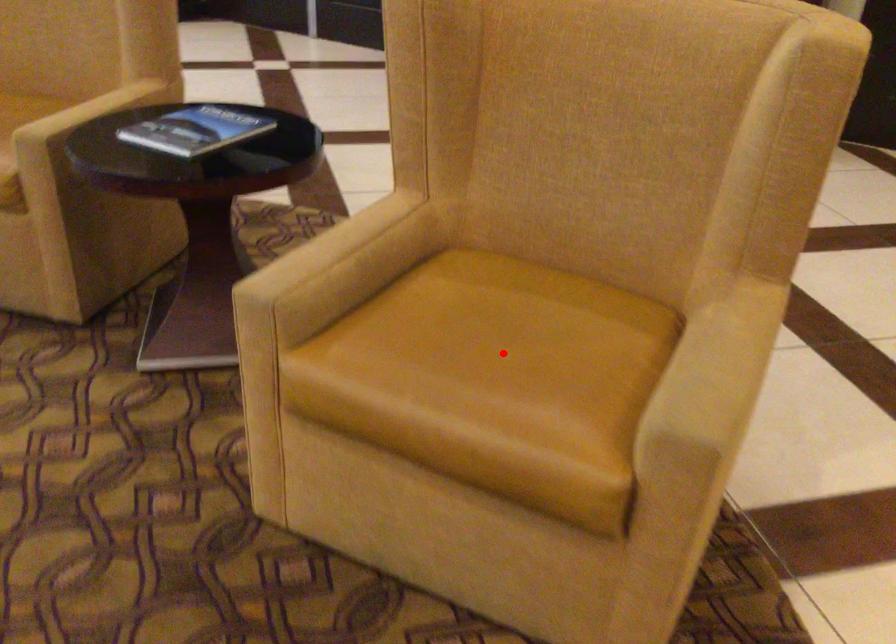
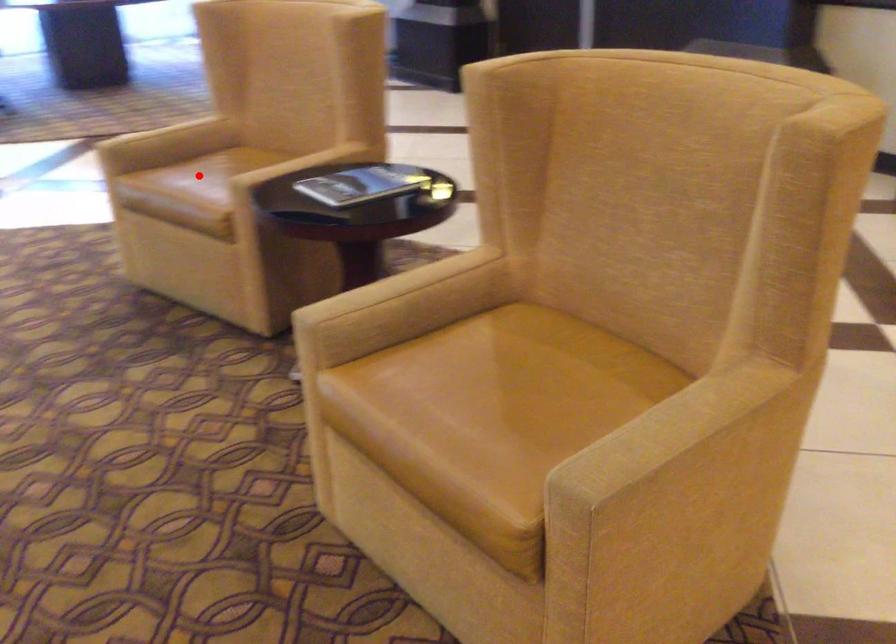
I am providing you with two images of the same scene from different viewpoints. A red point is marked on the first image and another point is marked on the second image. Does the point marked in image1 correspond to the same location as the one in image2?

No